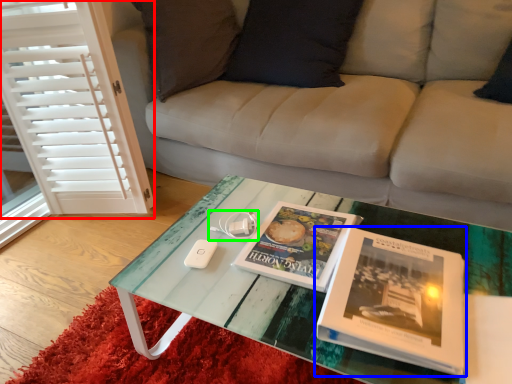
Question: Which object is positioned farthest from screen door (highlighted by a red box)? Select from book (highlighted by a blue box) and game controller (highlighted by a green box).

Choices:
 (A) book
 (B) game controller

Answer: (A)